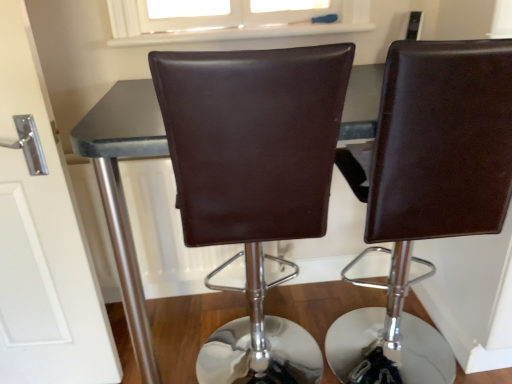
What do you see at coordinates (430, 188) in the screenshot? I see `brown leather chair at center, arranged as the second chair when viewed from the left` at bounding box center [430, 188].

You are a GUI agent. You are given a task and a screenshot of the screen. Output one action in this format:
    pyautogui.click(x=<x>, y=<y>)
    Task: Click on the brown leather chair at center, the second chair in the right-to-left sequence
    The height and width of the screenshot is (384, 512).
    Given the screenshot: What is the action you would take?
    pyautogui.click(x=254, y=180)

Describe the element at coordinates (120, 193) in the screenshot. I see `matte black table at center` at that location.

Find the location of a particular element. The width and height of the screenshot is (512, 384). matte black table at center is located at coordinates (120, 193).

I want to click on white glossy door at left, so click(x=42, y=237).

Which object is further away from the camera, brown leather chair at center, positioned as the first chair in left-to-right order, or brown leather chair at center, arranged as the second chair when viewed from the left?

Positioned behind is brown leather chair at center, arranged as the second chair when viewed from the left.

From a real-world perspective, between brown leather chair at center, the second chair in the right-to-left sequence, and brown leather chair at center, which is the 1th chair in right-to-left order, who is vertically higher?

brown leather chair at center, the second chair in the right-to-left sequence, is physically above.

Considering the positions of point (286, 112) and point (393, 112), is point (286, 112) closer or farther from the camera than point (393, 112)?

Point (286, 112) is positioned closer to the camera compared to point (393, 112).

Find the location of a particular element. This screenshot has width=512, height=384. chair on the left of brown leather chair at center, which is the 1th chair in right-to-left order is located at coordinates (254, 180).

Based on the photo, from a real-world perspective, is matte black table at center on white glossy door at left?

Actually, matte black table at center is physically below white glossy door at left in the real world.

Which is closer to the camera, (88, 238) or (11, 251)?

Point (88, 238) appears to be farther away from the viewer than point (11, 251).

Based on the photo, is matte black table at center positioned with its back to white glossy door at left?

No, matte black table at center is not facing the opposite direction of white glossy door at left.

Does point (100, 242) come farther from viewer compared to point (190, 102)?

Yes, it is.

Considering the positions of objects matte black table at center and brown leather chair at center, positioned as the first chair in left-to-right order, in the image provided, who is behind, matte black table at center or brown leather chair at center, positioned as the first chair in left-to-right order,?

matte black table at center is further from the camera.

Does matte black table at center have a smaller size compared to brown leather chair at center, the second chair in the right-to-left sequence?

Actually, matte black table at center might be larger than brown leather chair at center, the second chair in the right-to-left sequence.

From the image's perspective, which is above, white glossy door at left or brown leather chair at center, which is the 1th chair in right-to-left order?

brown leather chair at center, which is the 1th chair in right-to-left order, is shown above in the image.

Looking at the image, does white glossy door at left seem bigger or smaller compared to brown leather chair at center, which is the 1th chair in right-to-left order?

Considering their sizes, white glossy door at left takes up less space than brown leather chair at center, which is the 1th chair in right-to-left order.

Is white glossy door at left touching brown leather chair at center, which is the 1th chair in right-to-left order?

No, white glossy door at left is not next to brown leather chair at center, which is the 1th chair in right-to-left order.

Is point (63, 296) behind point (431, 195)?

Yes, point (63, 296) is farther from viewer.

Relative to matte black table at center, is white glossy door at left in front or behind?

white glossy door at left is behind matte black table at center.

Considering the relative positions of white glossy door at left and matte black table at center in the image provided, is white glossy door at left to the right of matte black table at center from the viewer's perspective?

In fact, white glossy door at left is to the left of matte black table at center.

Is white glossy door at left thinner than matte black table at center?

Correct, the width of white glossy door at left is less than that of matte black table at center.

Where is `table in front of the white glossy door at left`? table in front of the white glossy door at left is located at coordinates (120, 193).

Which is more to the right, brown leather chair at center, arranged as the second chair when viewed from the left, or brown leather chair at center, the second chair in the right-to-left sequence?

brown leather chair at center, arranged as the second chair when viewed from the left.

Between point (345, 271) and point (283, 103), which one is positioned in front?

The point (283, 103) is closer.

Choose the correct answer: Is brown leather chair at center, which is the 1th chair in right-to-left order, inside brown leather chair at center, the second chair in the right-to-left sequence, or outside it?

brown leather chair at center, which is the 1th chair in right-to-left order, is located beyond the bounds of brown leather chair at center, the second chair in the right-to-left sequence.

Considering the relative positions of brown leather chair at center, arranged as the second chair when viewed from the left, and brown leather chair at center, positioned as the first chair in left-to-right order, in the image provided, is brown leather chair at center, arranged as the second chair when viewed from the left, behind brown leather chair at center, positioned as the first chair in left-to-right order,?

Yes, it is behind brown leather chair at center, positioned as the first chair in left-to-right order.

Is brown leather chair at center, positioned as the first chair in left-to-right order, situated inside white glossy door at left or outside?

brown leather chair at center, positioned as the first chair in left-to-right order, is not enclosed by white glossy door at left.

From a real-world perspective, which object rests below the other?

brown leather chair at center, positioned as the first chair in left-to-right order, is physically lower.

From the image's perspective, is brown leather chair at center, the second chair in the right-to-left sequence, located above white glossy door at left?

No, from the image's perspective, brown leather chair at center, the second chair in the right-to-left sequence, is not over white glossy door at left.

At what (x,y) coordinates should I click in order to perform the action: click on chair below the brown leather chair at center, the second chair in the right-to-left sequence (from a real-world perspective). Please return your answer as a coordinate pair (x, y). Looking at the image, I should click on (430, 188).

Identify the location of door on the left of the matte black table at center. (42, 237).

When comparing their distances from brown leather chair at center, the second chair in the right-to-left sequence, does brown leather chair at center, arranged as the second chair when viewed from the left, or matte black table at center seem closer?

The object closer to brown leather chair at center, the second chair in the right-to-left sequence, is matte black table at center.

When comparing their distances from brown leather chair at center, arranged as the second chair when viewed from the left, does brown leather chair at center, positioned as the first chair in left-to-right order, or matte black table at center seem closer?

Among the two, brown leather chair at center, positioned as the first chair in left-to-right order, is located nearer to brown leather chair at center, arranged as the second chair when viewed from the left.

Based on their spatial positions, is brown leather chair at center, arranged as the second chair when viewed from the left, or matte black table at center closer to white glossy door at left?

matte black table at center.

Considering their positions, is white glossy door at left positioned further to brown leather chair at center, which is the 1th chair in right-to-left order, than matte black table at center?

Based on the image, white glossy door at left appears to be further to brown leather chair at center, which is the 1th chair in right-to-left order.

Based on their spatial positions, is brown leather chair at center, positioned as the first chair in left-to-right order, or brown leather chair at center, arranged as the second chair when viewed from the left, further from white glossy door at left?

brown leather chair at center, arranged as the second chair when viewed from the left, is further to white glossy door at left.

Estimate the real-world distances between objects in this image. Which object is closer to matte black table at center, brown leather chair at center, the second chair in the right-to-left sequence, or brown leather chair at center, arranged as the second chair when viewed from the left?

Among the two, brown leather chair at center, the second chair in the right-to-left sequence, is located nearer to matte black table at center.

Looking at the image, which one is located closer to white glossy door at left, matte black table at center or brown leather chair at center, positioned as the first chair in left-to-right order?

matte black table at center is positioned closer to the anchor white glossy door at left.

From the image, which object appears to be farther from matte black table at center, white glossy door at left or brown leather chair at center, arranged as the second chair when viewed from the left?

brown leather chair at center, arranged as the second chair when viewed from the left, is further to matte black table at center.

In order to click on table between brown leather chair at center, the second chair in the right-to-left sequence, and brown leather chair at center, arranged as the second chair when viewed from the left, in the horizontal direction in this screenshot , I will do `click(120, 193)`.

Locate an element on the screen. Image resolution: width=512 pixels, height=384 pixels. chair between white glossy door at left and brown leather chair at center, which is the 1th chair in right-to-left order is located at coordinates [254, 180].

Locate an element on the screen. chair between white glossy door at left and matte black table at center from left to right is located at coordinates click(254, 180).

Image resolution: width=512 pixels, height=384 pixels. In order to click on table between white glossy door at left and brown leather chair at center, which is the 1th chair in right-to-left order, in the horizontal direction in this screenshot , I will do `click(120, 193)`.